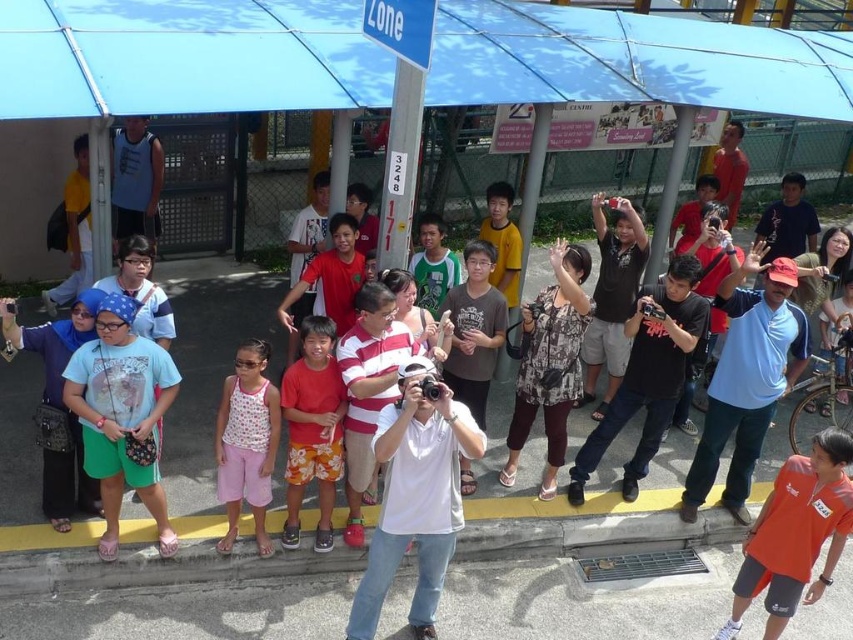
Question: Where is orange jersey at center located in relation to floral shorts at center in the image?

Choices:
 (A) below
 (B) above

Answer: (A)

Question: Estimate the real-world distances between objects in this image. Which object is farther from the pink cotton shorts at center?

Choices:
 (A) white cotton camera at center
 (B) blue fabric canopy at upper center

Answer: (B)

Question: Is blue fabric canopy at upper center bigger than white cotton camera at center?

Choices:
 (A) yes
 (B) no

Answer: (B)

Question: Which point is closer to the camera?

Choices:
 (A) (248, 396)
 (B) (425, 605)
 (C) (299, 404)

Answer: (B)

Question: Which of these objects is positioned closest to the floral shorts at center?

Choices:
 (A) white cotton camera at center
 (B) pink cotton shorts at center
 (C) blue fabric canopy at upper center

Answer: (B)

Question: Does white cotton camera at center appear under floral shorts at center?

Choices:
 (A) yes
 (B) no

Answer: (A)